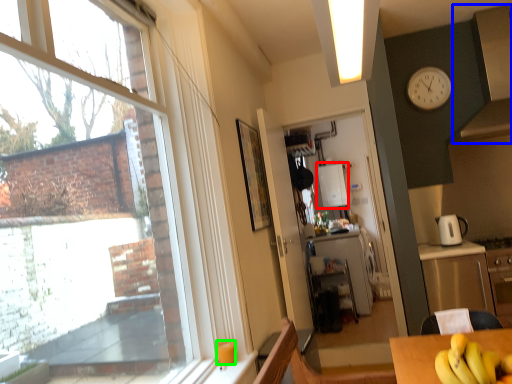
Question: Which object is positioned closest to appliance (highlighted by a red box)? Select from exhaust hood (highlighted by a blue box) and coffee cup (highlighted by a green box).

Choices:
 (A) exhaust hood
 (B) coffee cup

Answer: (A)